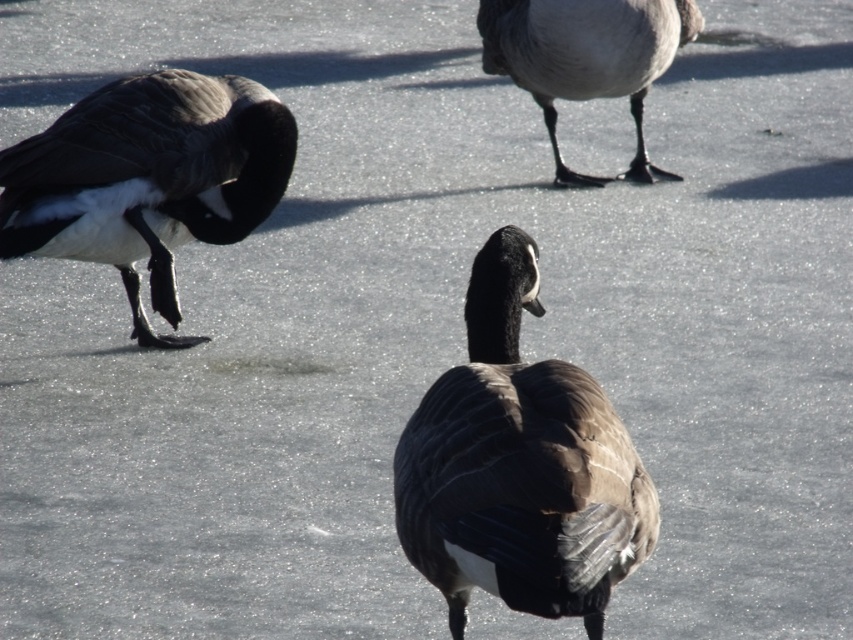
Looking at this image, measure the distance between point (479, 573) and camera.

Point (479, 573) is 8.82 feet from camera.

Which is more to the right, brown textured goose at center or gray matte duck feet at upper center?

Positioned to the right is gray matte duck feet at upper center.

Is point (453, 596) behind point (552, 100)?

No, it is in front of (552, 100).

Find the location of `brown textured goose at center`. brown textured goose at center is located at coordinates (519, 467).

Can you confirm if dark brown feathers at left is wider than gray matte duck feet at upper center?

Incorrect, dark brown feathers at left's width does not surpass gray matte duck feet at upper center's.

Is dark brown feathers at left above gray matte duck feet at upper center?

Actually, dark brown feathers at left is below gray matte duck feet at upper center.

The image size is (853, 640). Describe the element at coordinates (148, 179) in the screenshot. I see `dark brown feathers at left` at that location.

Find the location of `dark brown feathers at left`. dark brown feathers at left is located at coordinates (148, 179).

Does brown textured goose at center have a smaller size compared to dark brown feathers at left?

Correct, brown textured goose at center occupies less space than dark brown feathers at left.

Who is taller, brown textured goose at center or dark brown feathers at left?

dark brown feathers at left is taller.

Between point (474, 529) and point (83, 145), which one is positioned in front?

Point (474, 529) is more forward.

Find the location of `brown textured goose at center`. brown textured goose at center is located at coordinates (519, 467).